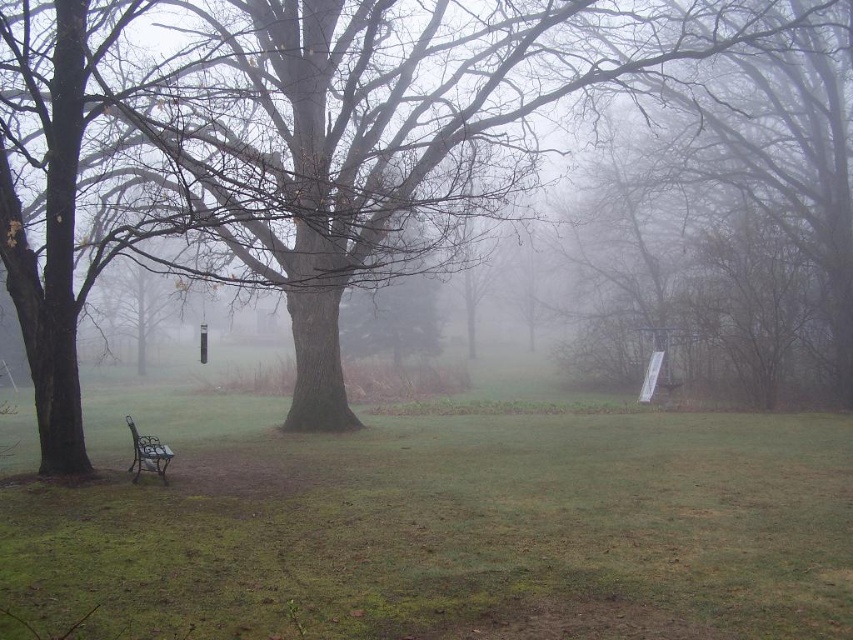
You are a park visitor who wants to take a photo of the brown matte tree at center and the metallic brown bench at lower left. If you stand at the far end of the park, which object will appear larger in your camera viewfinder?

The brown matte tree at center appears larger in the camera viewfinder because it is taller than the metallic brown bench at lower left.

You are planning to sit on the metallic brown bench at lower left. Based on the scene, can you see the top of the brown matte tree at center from that position?

Yes, because the brown matte tree at center is above the metallic brown bench at lower left, so the top of the tree would be visible from the bench.